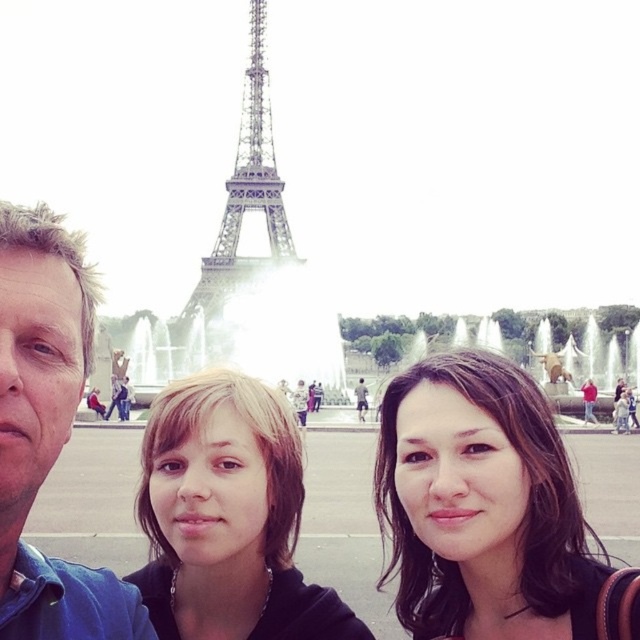
Question: Is dark brown hair at center to the right of blue fabric shirt at left from the viewer's perspective?

Choices:
 (A) no
 (B) yes

Answer: (B)

Question: Which point is farther to the camera?

Choices:
 (A) dark brown hair at center
 (B) blonde hair at center
 (C) blue fabric shirt at left
 (D) metallic silver eiffel tower at center

Answer: (B)

Question: Is dark brown hair at center further to the viewer compared to blonde hair at center?

Choices:
 (A) yes
 (B) no

Answer: (B)

Question: Based on their relative distances, which object is nearer to the metallic silver eiffel tower at center?

Choices:
 (A) blue fabric shirt at left
 (B) blonde hair at center
 (C) dark brown hair at center

Answer: (B)

Question: Does blonde hair at center appear under blue fabric shirt at left?

Choices:
 (A) no
 (B) yes

Answer: (B)

Question: Based on their relative distances, which object is nearer to the metallic silver eiffel tower at center?

Choices:
 (A) blonde hair at center
 (B) blue fabric shirt at left
 (C) dark brown hair at center

Answer: (A)